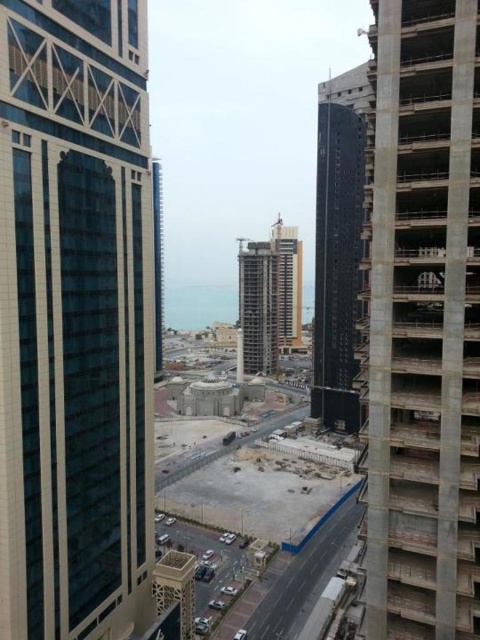
Is glassy blue skyscraper at left shorter than concrete construction at center?

In fact, glassy blue skyscraper at left may be taller than concrete construction at center.

Does glassy blue skyscraper at left have a larger size compared to concrete construction at center?

Incorrect, glassy blue skyscraper at left is not larger than concrete construction at center.

The image size is (480, 640). Describe the element at coordinates (74, 317) in the screenshot. I see `glassy blue skyscraper at left` at that location.

The image size is (480, 640). I want to click on glassy blue skyscraper at left, so click(74, 317).

Can you confirm if glassy blue skyscraper at left is smaller than glassy concrete skyscraper at center?

Correct, glassy blue skyscraper at left occupies less space than glassy concrete skyscraper at center.

Describe the element at coordinates (74, 317) in the screenshot. I see `glassy blue skyscraper at left` at that location.

Is point (112, 525) closer to camera compared to point (288, 328)?

Yes, it is in front of point (288, 328).

The image size is (480, 640). What are the coordinates of `glassy blue skyscraper at left` in the screenshot? It's located at (74, 317).

Between concrete at right and white concrete construction site at center, which one is positioned lower?

white concrete construction site at center is lower down.

Between point (474, 545) and point (271, 424), which one is positioned in front?

Point (474, 545) is more forward.

The image size is (480, 640). Identify the location of concrete at right. (421, 321).